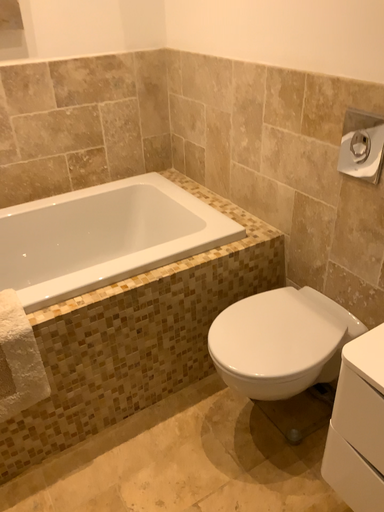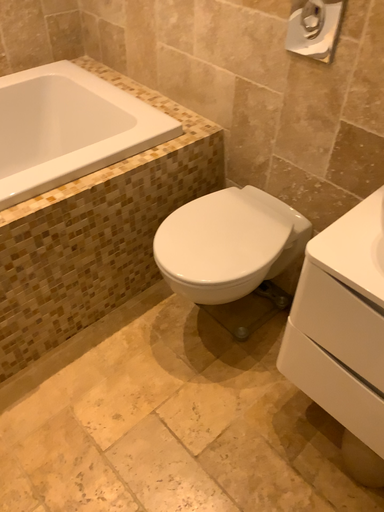
Question: Which way did the camera rotate in the video?

Choices:
 (A) rotated downward
 (B) rotated upward

Answer: (A)